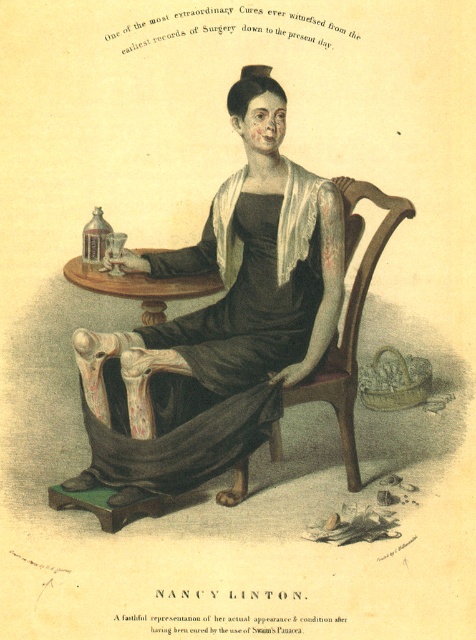
You are standing in front of the vintage illustration of Nancy Linton. You notice two points marked in the image. According to their positions, which point is closer to you, point (239, 428) or point (170, 284)?

Point (239, 428) is in front of point (170, 284), so it is closer to you.

Based on the scene described, which object is taller between the matte black dress at center and the wooden polished table at center left?

The matte black dress at center is much taller than the wooden polished table at center left according to the description.

You are an art conservator examining the vintage illustration of Nancy Linton. You need to determine the spatial relationship between the matte black dress at center and the wooden polished table at center left. Which object is positioned closer to the viewer?

The matte black dress at center is closer to the viewer than the wooden polished table at center left.